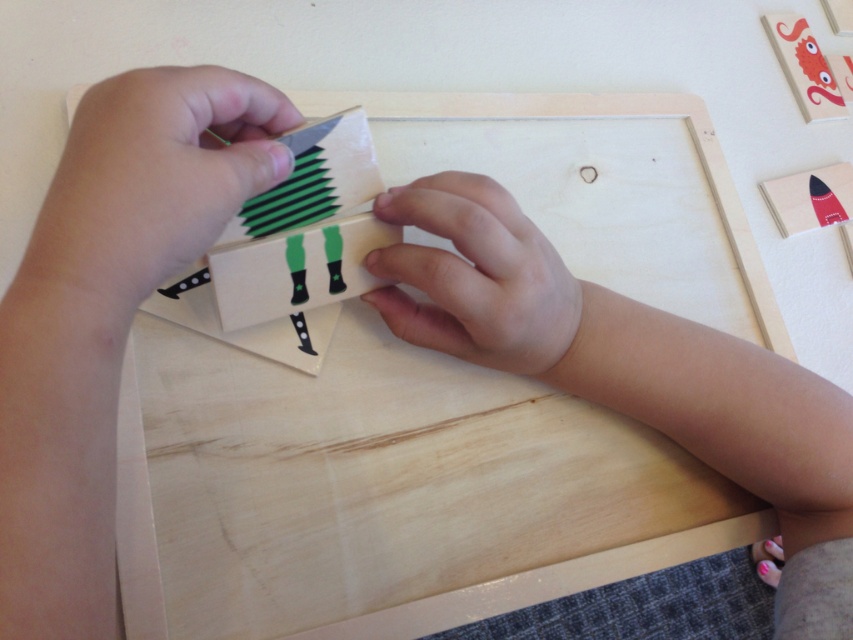
Between green matte paper at upper center and matte red rocket at upper right, which one has less height?

matte red rocket at upper right

Is point (283, 221) in front of point (817, 180)?

Yes, point (283, 221) is in front of point (817, 180).

Image resolution: width=853 pixels, height=640 pixels. Identify the location of green matte paper at upper center. (312, 179).

Find the location of a particular element. This screenshot has width=853, height=640. green matte paper at upper center is located at coordinates (312, 179).

Who is taller, matte green paper at center or green matte paper at upper center?

green matte paper at upper center is taller.

Is point (328, 264) closer to camera compared to point (303, 168)?

No, it is behind (303, 168).

In order to click on matte green paper at center in this screenshot , I will do `click(297, 268)`.

Describe the element at coordinates (477, 278) in the screenshot. I see `smooth skin hand at center` at that location.

Who is more forward, (x=456, y=308) or (x=242, y=204)?

Point (x=242, y=204) is more forward.

Between point (537, 368) and point (294, 145), which one is positioned behind?

The point (537, 368) is behind.

Locate an element on the screen. smooth skin hand at center is located at coordinates (477, 278).